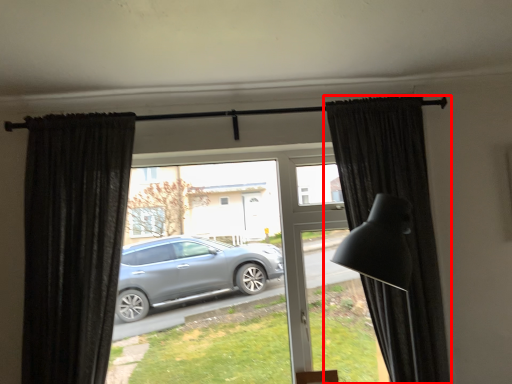
Question: From the image's perspective, where is curtain (annotated by the red box) located in relation to curtain in the image?

Choices:
 (A) below
 (B) above

Answer: (B)